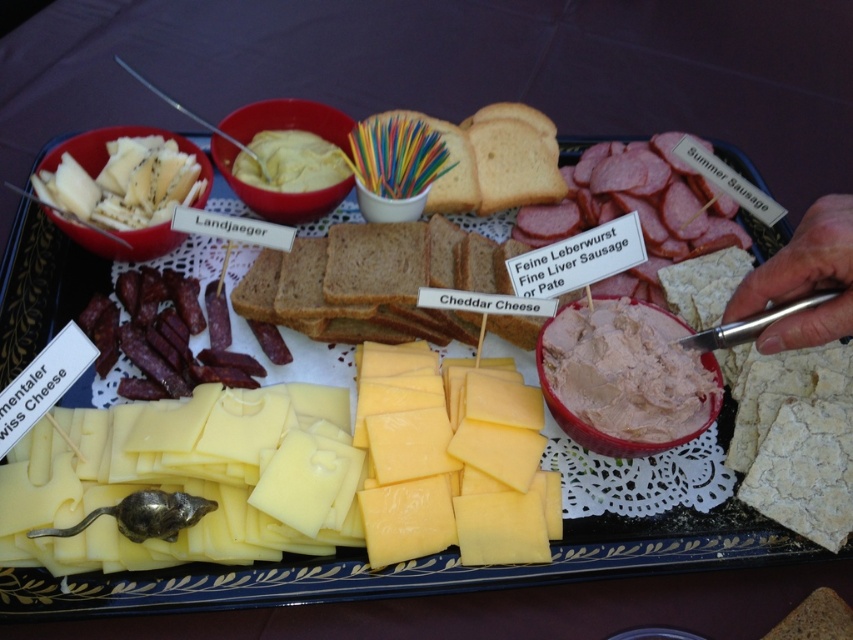
Question: Among these points, which one is farthest from the camera?

Choices:
 (A) tap(270, 172)
 (B) tap(262, 252)
 (C) tap(102, 502)

Answer: (A)

Question: Which point is farther from the camera taking this photo?

Choices:
 (A) (346, 259)
 (B) (666, 321)

Answer: (A)

Question: Which object is farther from the camera taking this photo?

Choices:
 (A) pink creamy spread at center
 (B) brown matte bread at center
 (C) white creamy spread at center
 (D) yellow hard cheese at center

Answer: (C)

Question: Does pink creamy spread at center appear over white creamy spread at center?

Choices:
 (A) yes
 (B) no

Answer: (B)

Question: From the image, what is the correct spatial relationship of yellow hard cheese at center in relation to white creamy spread at center?

Choices:
 (A) left
 (B) right

Answer: (B)

Question: Does brown matte bread at center lie in front of pink creamy spread at center?

Choices:
 (A) no
 (B) yes

Answer: (A)